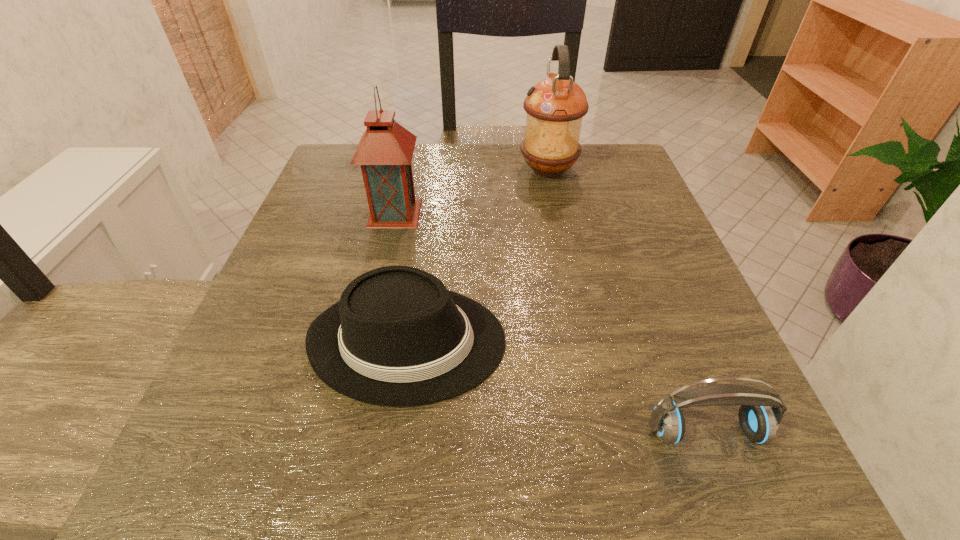
The height and width of the screenshot is (540, 960). I want to click on fedora that is at the left edge, so click(397, 337).

What are the coordinates of `oil lamp at the right edge` in the screenshot? It's located at (555, 106).

At what (x,y) coordinates should I click in order to perform the action: click on headset situated at the right edge. Please return your answer as a coordinate pair (x, y). Image resolution: width=960 pixels, height=540 pixels. Looking at the image, I should click on (759, 422).

You are a GUI agent. You are given a task and a screenshot of the screen. Output one action in this format:
    pyautogui.click(x=<x>, y=<y>)
    Task: Click on the object that is at the far right corner
    The height and width of the screenshot is (540, 960).
    Given the screenshot: What is the action you would take?
    [555, 106]

Find the location of a particular element. This screenshot has width=960, height=540. object that is at the near right corner is located at coordinates (759, 422).

I want to click on free point at the far edge, so (x=530, y=184).

Where is `vacant space at the near edge of the desktop`? This screenshot has height=540, width=960. vacant space at the near edge of the desktop is located at coordinates (647, 455).

Where is `vacant point at the left edge`? vacant point at the left edge is located at coordinates (353, 240).

I want to click on vacant space at the right edge of the desktop, so click(697, 336).

You are a GUI agent. You are given a task and a screenshot of the screen. Output one action in this format:
    pyautogui.click(x=<x>, y=<y>)
    Task: Click on the vacant area at the near left corner
    
    Given the screenshot: What is the action you would take?
    pyautogui.click(x=229, y=462)